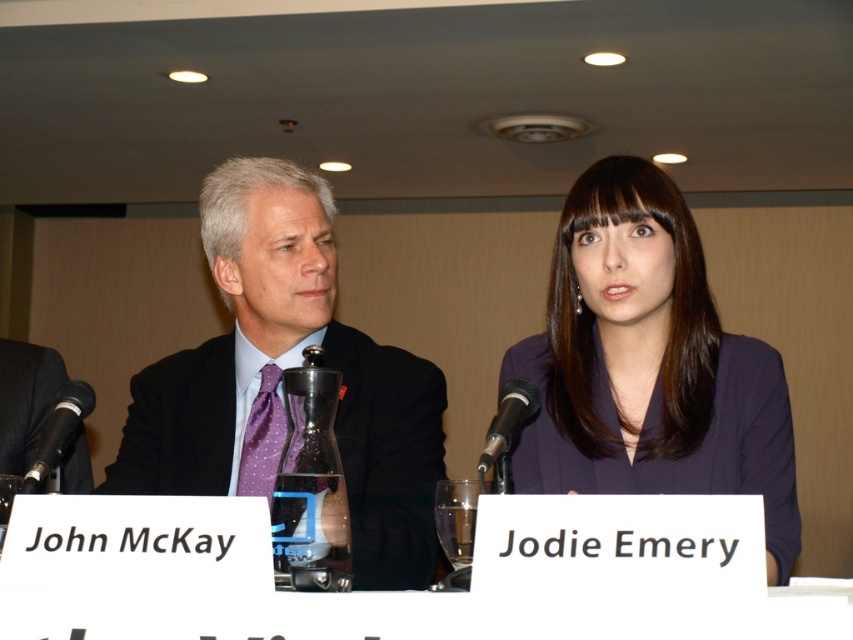
From the picture: You are standing in front of the conference table and want to place a small object exactly halfway between the point at coordinate (86, 401) and the point at coordinate (529, 397). Will the midpoint be closer to the wall behind the individuals or closer to the front edge of the table?

The midpoint between the two points would be closer to the wall behind the individuals because point (86, 401) is closer to the viewer than point (529, 397). Since the midpoint is calculated by averaging the coordinates, the vertical position would be halfway between 0.103 and 0.621, which is approximately 0.362. This places it closer to the wall compared to the front edge of the table.

You are standing in front of the conference table and need to place a name tag exactly at the position of the matte black suit at left. According to the coordinates provided, where should you place the name tag?

The matte black suit at left is located at point (280, 378), so you should place the name tag at those coordinates.

You are a photographer setting up for a press conference. You need to ensure that the black matte microphone at left and the black metallic microphone at center are visible in your shot. Given their heights, which microphone might be more likely to block the view of the other?

The black matte microphone at left is much taller than the black metallic microphone at center, so it might block the view of the black metallic microphone at center.